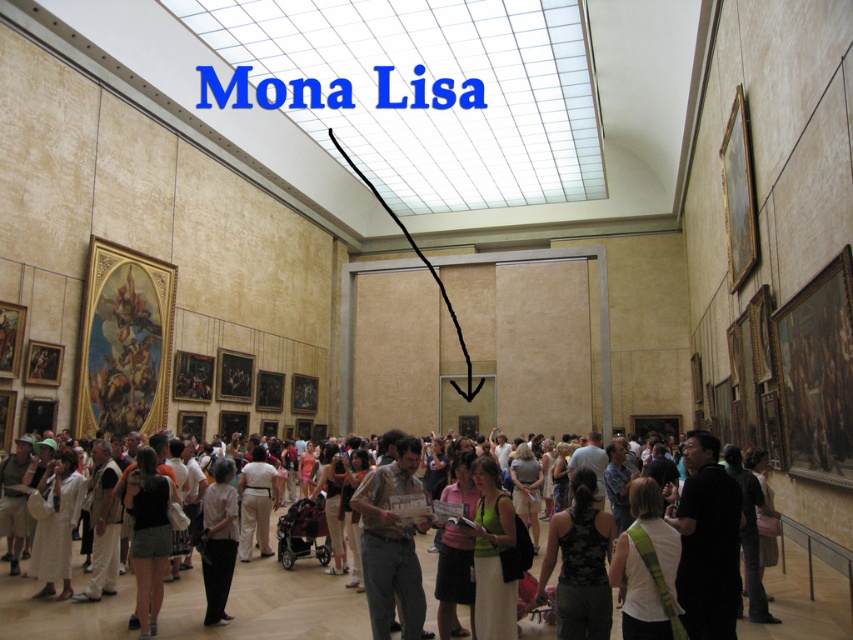
Question: Which of the following is the closest to the observer?

Choices:
 (A) white cotton crowd at center
 (B) white cotton shirt at center
 (C) white cotton dress at lower left

Answer: (A)

Question: Does white cotton dress at lower left lie behind white cotton shirt at center?

Choices:
 (A) no
 (B) yes

Answer: (B)

Question: Which object is farther from the camera taking this photo?

Choices:
 (A) white cotton shirt at center
 (B) matte black dress at center

Answer: (B)

Question: Can you confirm if green fabric dress at center is positioned to the right of matte black stroller at center?

Choices:
 (A) no
 (B) yes

Answer: (B)

Question: Is the position of white fabric bag at center more distant than that of matte black stroller at center?

Choices:
 (A) yes
 (B) no

Answer: (B)

Question: Which object is farther from the camera taking this photo?

Choices:
 (A) matte black dress at center
 (B) white cotton dress at lower left
 (C) white fabric bag at center

Answer: (A)